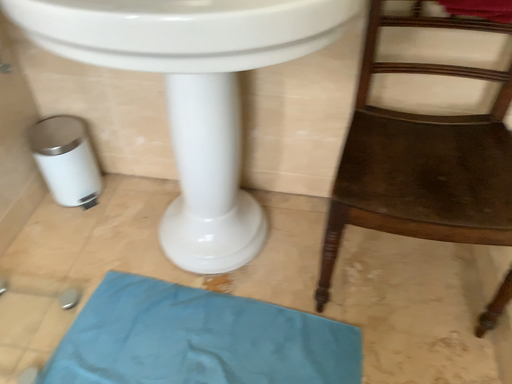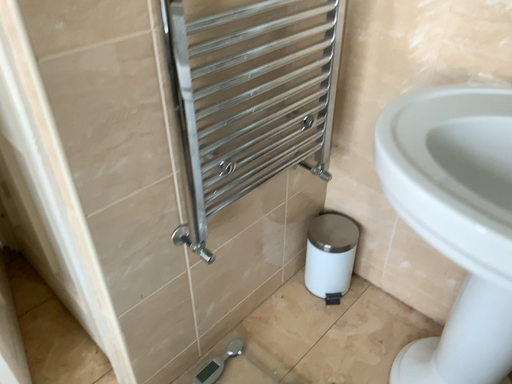
Question: How did the camera likely rotate when shooting the video?

Choices:
 (A) rotated left
 (B) rotated right

Answer: (A)